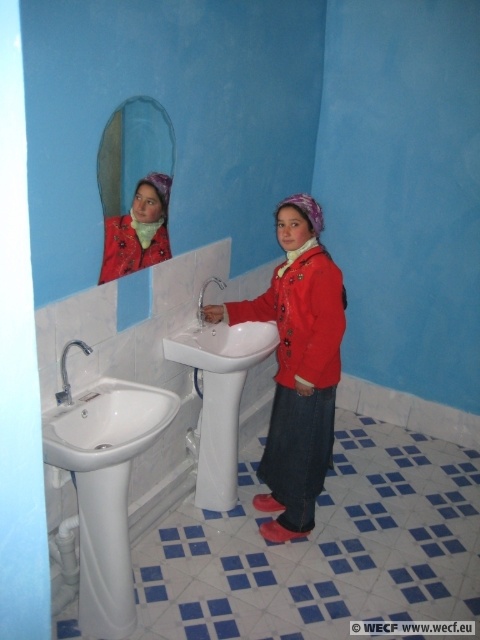
Question: Is brushed metal faucet at sink left wider than silver metallic faucet at sink left?

Choices:
 (A) yes
 (B) no

Answer: (B)

Question: Is brushed metal faucet at sink left positioned before silver metallic faucet at sink left?

Choices:
 (A) no
 (B) yes

Answer: (B)

Question: Considering the real-world distances, which object is farthest from the silver metallic faucet at sink left?

Choices:
 (A) matte red jacket at center
 (B) brushed metal faucet at sink left

Answer: (B)

Question: Which of these objects is positioned closest to the brushed metal faucet at sink left?

Choices:
 (A) silver metallic faucet at sink left
 (B) matte red jacket at center

Answer: (A)

Question: Does matte red jacket at center have a greater width compared to silver metallic faucet at sink left?

Choices:
 (A) no
 (B) yes

Answer: (B)

Question: Among these points, which one is nearest to the camera?

Choices:
 (A) (66, 368)
 (B) (273, 532)
 (C) (213, 282)

Answer: (A)